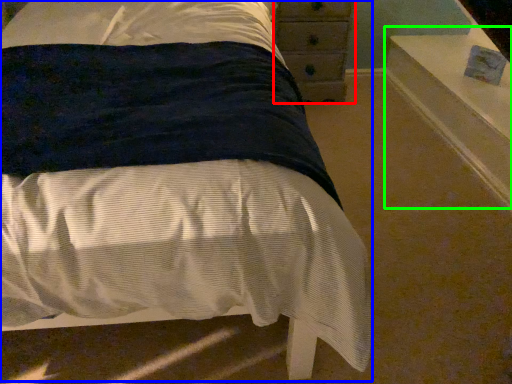
Question: Which object is the farthest from chest of drawers (highlighted by a red box)? Choose among these: bed (highlighted by a blue box) or window sill (highlighted by a green box).

Choices:
 (A) bed
 (B) window sill

Answer: (A)